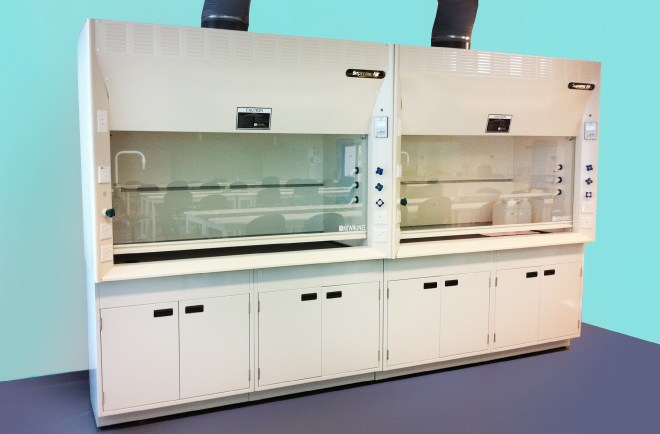
You are a GUI agent. You are given a task and a screenshot of the screen. Output one action in this format:
    pyautogui.click(x=<x>, y=<y>)
    Task: Click on the wall
    This screenshot has width=660, height=434.
    Given the screenshot: What is the action you would take?
    pyautogui.click(x=46, y=230)